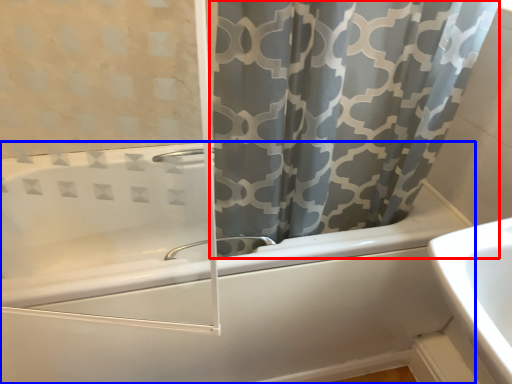
Question: Among these objects, which one is nearest to the camera, curtain (highlighted by a red box) or bathtub (highlighted by a blue box)?

Choices:
 (A) curtain
 (B) bathtub

Answer: (A)